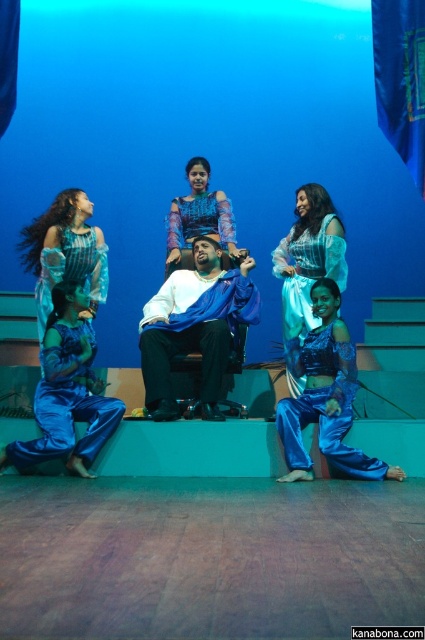
You are an actor standing on the stage in the image. You need to move to the blue satin pants at lower left. What is the exact 2D coordinate where you should look to find them?

The blue satin pants at lower left are located at the 2D coordinate point of (68,401).

You are directing a stage play and need to place a spotlight on the stage. You have two points marked on the stage floor at coordinates point [342,356] and point [50,296]. Which point is closer to the audience, so the spotlight will shine brighter there?

Point [342,356] is closer to the camera than point [50,296], so the spotlight placed there will shine brighter on the audience side.

You are a stagehand standing at the edge of the stage. You need to adjust the blue fabric draped at center which is 4.34 meters away. If your maximum reach is 2 meters, can you reach it without moving closer?

The blue fabric draped at center is 4.34 meters from the camera, which is beyond your 2 meter reach. You need to move closer to reach it.